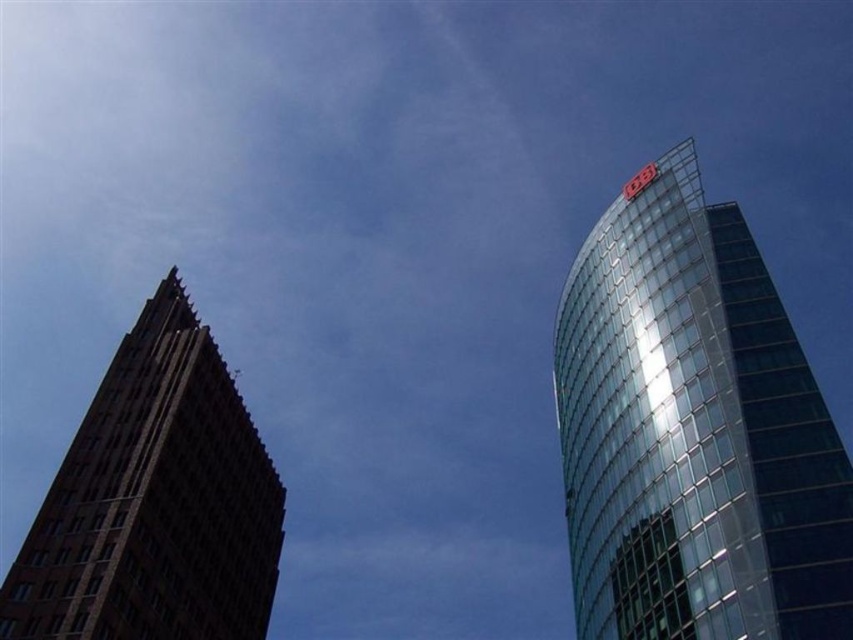
Question: Among these points, which one is farthest from the camera?

Choices:
 (A) (167, 564)
 (B) (660, 205)

Answer: (B)

Question: Can you confirm if transparent glass tower at right is wider than brown brick building at left?

Choices:
 (A) yes
 (B) no

Answer: (B)

Question: Does transparent glass tower at right have a larger size compared to brown brick building at left?

Choices:
 (A) no
 (B) yes

Answer: (B)

Question: Does transparent glass tower at right appear on the left side of brown brick building at left?

Choices:
 (A) yes
 (B) no

Answer: (B)

Question: Which object appears farthest from the camera in this image?

Choices:
 (A) brown brick building at left
 (B) transparent glass tower at right

Answer: (A)